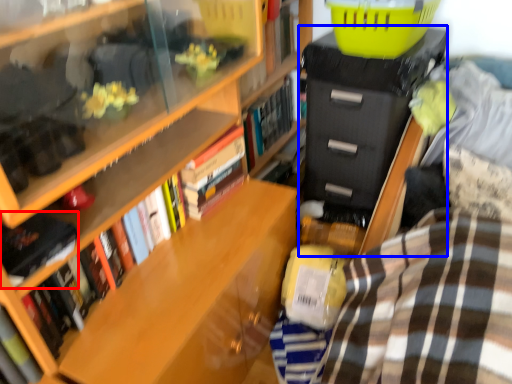
Question: Which object is closer to the camera taking this photo, book (highlighted by a red box) or file cabinet (highlighted by a blue box)?

Choices:
 (A) book
 (B) file cabinet

Answer: (A)